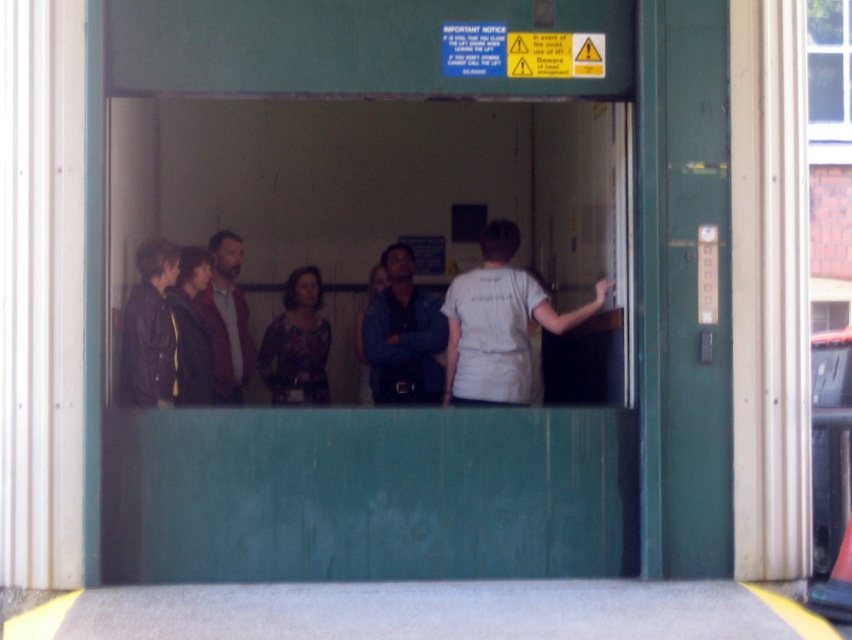
Which is behind, point (661, 96) or point (448, 339)?

Point (448, 339)

Can you confirm if green matte door at right is shorter than white cotton shirt at center?

No.

Identify the location of green matte door at right. (692, 292).

Identify the location of green matte door at right. The height and width of the screenshot is (640, 852). (692, 292).

Can you confirm if white cotton shirt at center is positioned below brown leather jacket at center?

No, white cotton shirt at center is not below brown leather jacket at center.

Does white cotton shirt at center appear on the right side of brown leather jacket at center?

Correct, you'll find white cotton shirt at center to the right of brown leather jacket at center.

What do you see at coordinates (499, 323) in the screenshot?
I see `white cotton shirt at center` at bounding box center [499, 323].

Image resolution: width=852 pixels, height=640 pixels. Identify the location of white cotton shirt at center. (499, 323).

Can you confirm if blue denim shirt at center is smaller than printed fabric blouse at center?

Yes.

The width and height of the screenshot is (852, 640). What do you see at coordinates (403, 336) in the screenshot?
I see `blue denim shirt at center` at bounding box center [403, 336].

At what (x,y) coordinates should I click in order to perform the action: click on blue denim shirt at center. Please return your answer as a coordinate pair (x, y). This screenshot has width=852, height=640. Looking at the image, I should click on (403, 336).